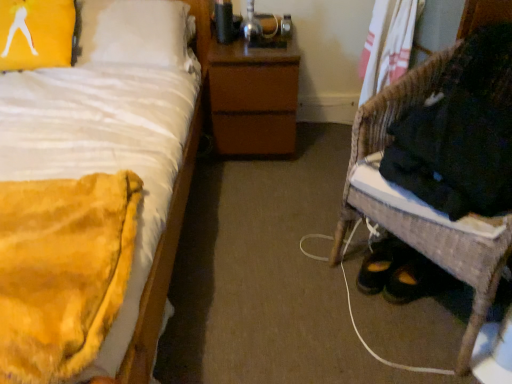
Where is `vacant space in between woven wicker chair at lower right and brown matte nightstand at center`? This screenshot has height=384, width=512. vacant space in between woven wicker chair at lower right and brown matte nightstand at center is located at coordinates (305, 185).